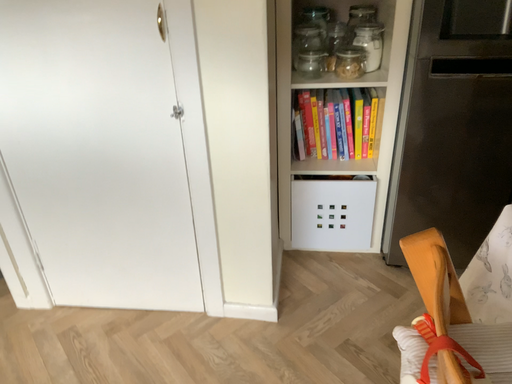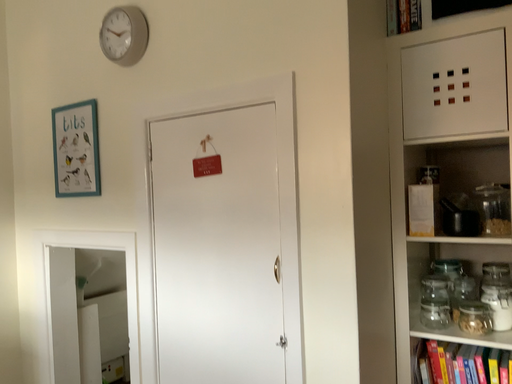
Question: Which way did the camera rotate in the video?

Choices:
 (A) rotated left
 (B) rotated right

Answer: (A)